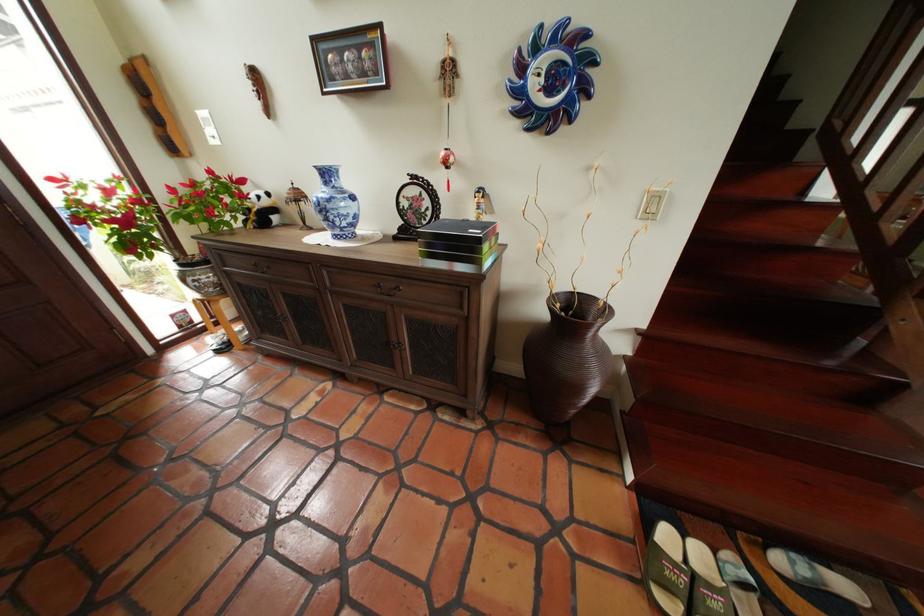
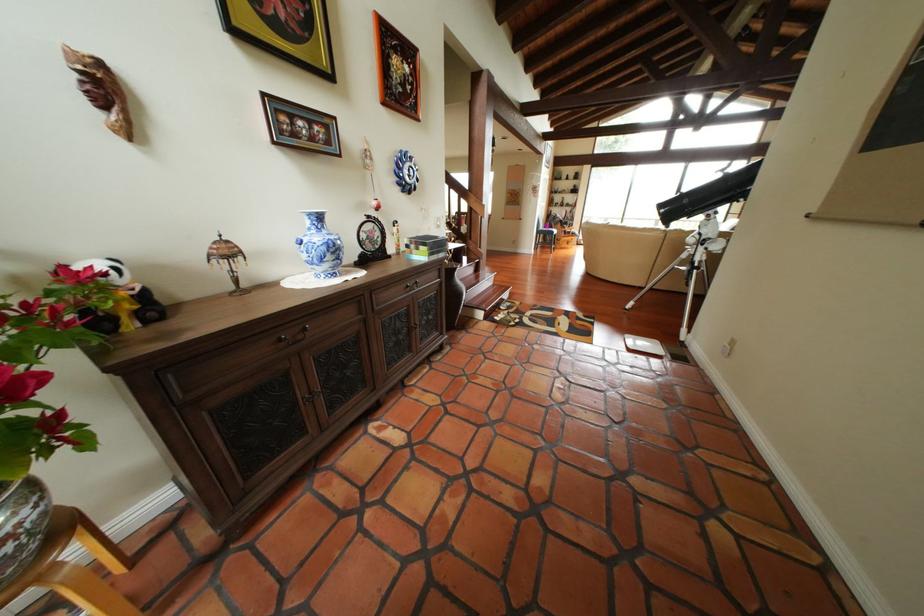
Locate, in the second image, the point that corresponds to the point at 442,246 in the first image.

(444, 249)